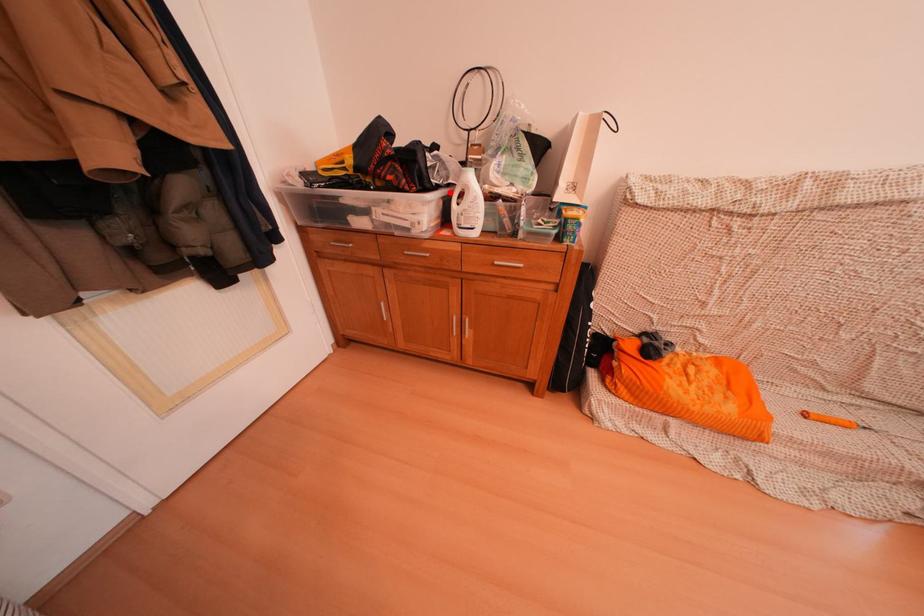
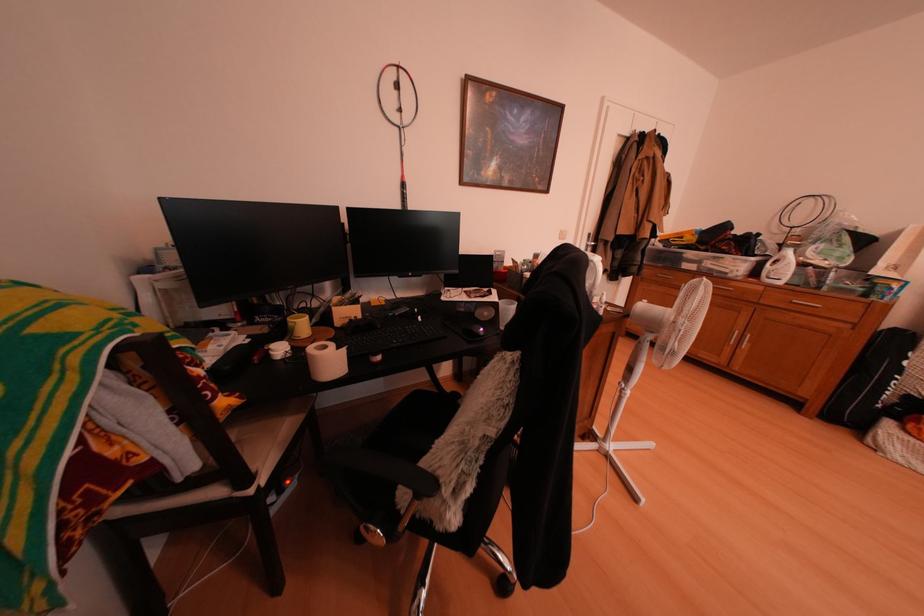
Where in the second image is the point corresponding to the highlighted location from the first image?

(767, 261)